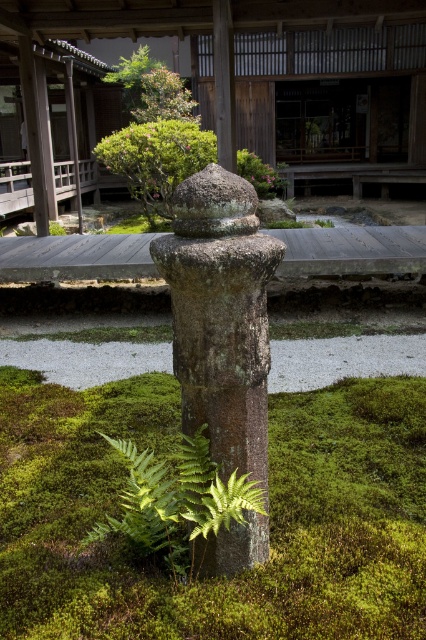
Which is behind, point (259, 412) or point (129, 104)?

Point (129, 104)

Is rusty stone post at center behind green leafy shrub at upper center?

No, it is in front of green leafy shrub at upper center.

Is point (250, 336) positioned in front of point (149, 60)?

That is True.

I want to click on rusty stone post at center, so click(221, 316).

Does green mossy grass at center appear over green leafy fern at center?

Actually, green mossy grass at center is below green leafy fern at center.

Is green mossy grass at center positioned at the back of green leafy fern at center?

Yes.

Which is in front, point (86, 568) or point (163, 512)?

Positioned in front is point (163, 512).

Locate an element on the screen. The image size is (426, 640). green mossy grass at center is located at coordinates (270, 516).

In the scene shown: Is rusty stone post at center smaller than green textured bush at center?

Yes.

Does point (210, 310) lie behind point (176, 173)?

That is False.

The width and height of the screenshot is (426, 640). What do you see at coordinates (221, 316) in the screenshot?
I see `rusty stone post at center` at bounding box center [221, 316].

Where is `rusty stone post at center`? The height and width of the screenshot is (640, 426). rusty stone post at center is located at coordinates (221, 316).